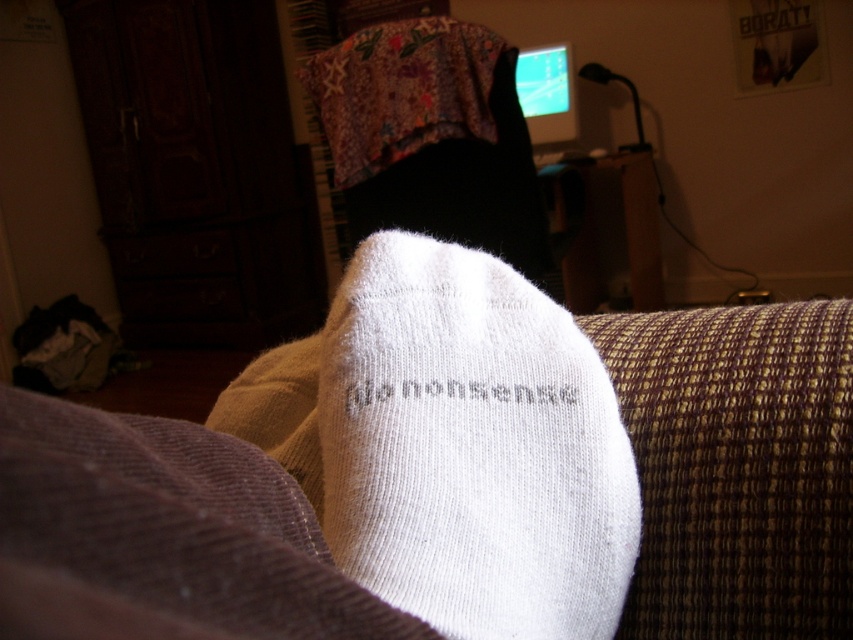
Question: Which point is farther to the camera?

Choices:
 (A) white knitted sock at center
 (B) white knitted couch at lower center

Answer: (B)

Question: Is the position of white knitted couch at lower center less distant than that of white knitted sock at center?

Choices:
 (A) yes
 (B) no

Answer: (B)

Question: Can you confirm if white knitted couch at lower center is wider than white knitted sock at center?

Choices:
 (A) no
 (B) yes

Answer: (A)

Question: Does white knitted couch at lower center lie in front of white knitted sock at center?

Choices:
 (A) yes
 (B) no

Answer: (B)